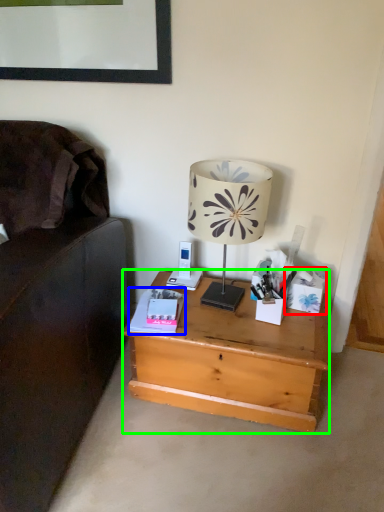
Question: Estimate the real-world distances between objects in this image. Which object is closer to box (highlighted by a red box), paperback book (highlighted by a blue box) or desk (highlighted by a green box)?

Choices:
 (A) paperback book
 (B) desk

Answer: (B)